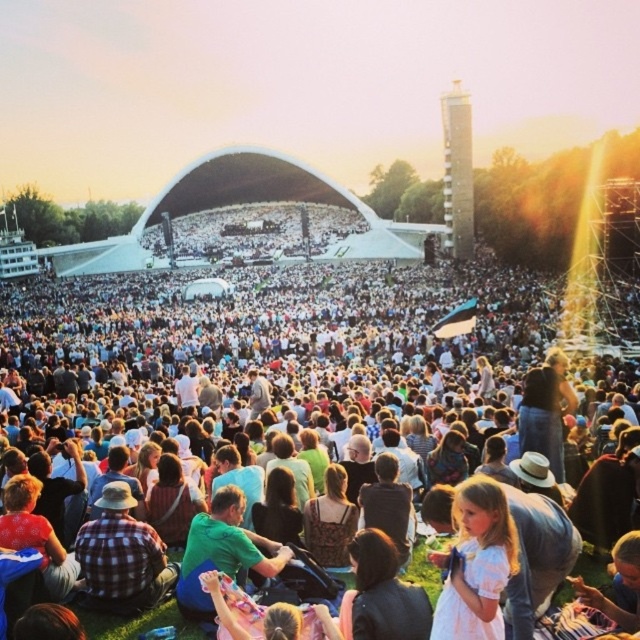
Question: Is white cotton dress at center thinner than denim jacket at lower right?

Choices:
 (A) yes
 (B) no

Answer: (A)

Question: Which object is closer to the camera taking this photo?

Choices:
 (A) plaid fabric shirt at center
 (B) denim jacket at lower right

Answer: (A)

Question: Among these objects, which one is nearest to the camera?

Choices:
 (A) white cotton dress at center
 (B) denim jacket at lower right
 (C) matte white tent at upper center
 (D) plaid fabric shirt at center

Answer: (A)

Question: Is matte white tent at upper center closer to the viewer compared to plaid fabric shirt at center?

Choices:
 (A) no
 (B) yes

Answer: (B)

Question: Estimate the real-world distances between objects in this image. Which object is closer to the denim jacket at lower right?

Choices:
 (A) matte white tent at upper center
 (B) plaid fabric shirt at center

Answer: (A)

Question: Can you confirm if white cotton dress at center is positioned to the right of plaid fabric shirt at center?

Choices:
 (A) no
 (B) yes

Answer: (B)